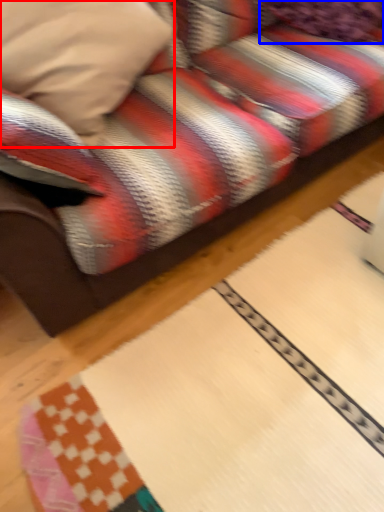
Question: Which object is further to the camera taking this photo, pillow (highlighted by a red box) or pillow (highlighted by a blue box)?

Choices:
 (A) pillow
 (B) pillow

Answer: (B)